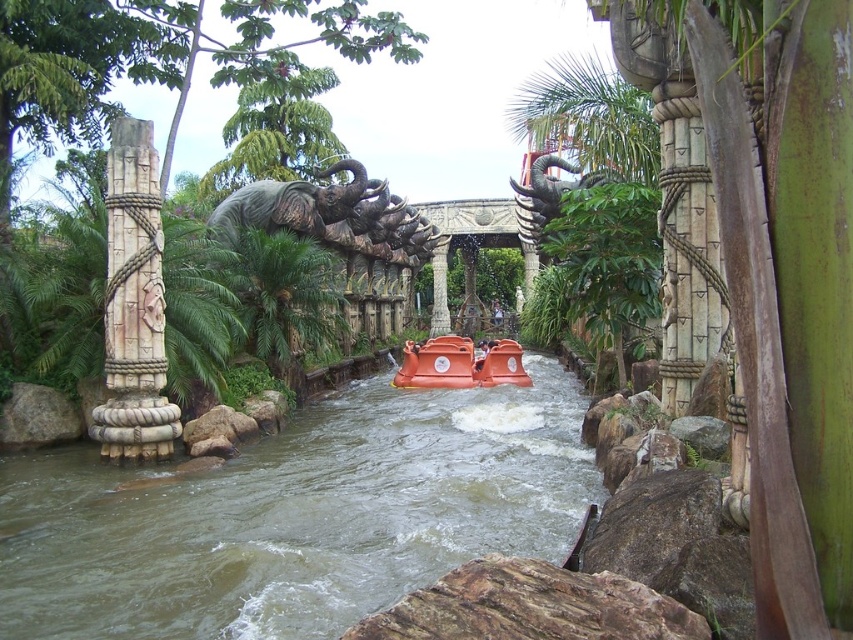
Can you confirm if brown rubber boat at center is bigger than carved stone column at left?

Indeed, brown rubber boat at center has a larger size compared to carved stone column at left.

Does brown rubber boat at center appear over carved stone column at left?

Incorrect, brown rubber boat at center is not positioned above carved stone column at left.

Is point (558, 396) farther from camera compared to point (143, 285)?

Yes, point (558, 396) is behind point (143, 285).

At what (x,y) coordinates should I click in order to perform the action: click on brown rubber boat at center. Please return your answer as a coordinate pair (x, y). This screenshot has width=853, height=640. Looking at the image, I should click on (296, 516).

Is point (215, 634) positioned in front of point (235, 212)?

That is True.

Measure the distance from brown rubber boat at center to rustic stone elephant at center.

brown rubber boat at center is 162.60 feet away from rustic stone elephant at center.

Does point (225, 493) come farther from viewer compared to point (374, 195)?

That is False.

At what (x,y) coordinates should I click in order to perform the action: click on brown rubber boat at center. Please return your answer as a coordinate pair (x, y). Looking at the image, I should click on (296, 516).

Can you confirm if carved stone column at left is positioned to the left of stone statue at center?

Yes, carved stone column at left is to the left of stone statue at center.

Is carved stone column at left bigger than stone statue at center?

Yes.

Where is `carved stone column at left`? The image size is (853, 640). carved stone column at left is located at coordinates (134, 305).